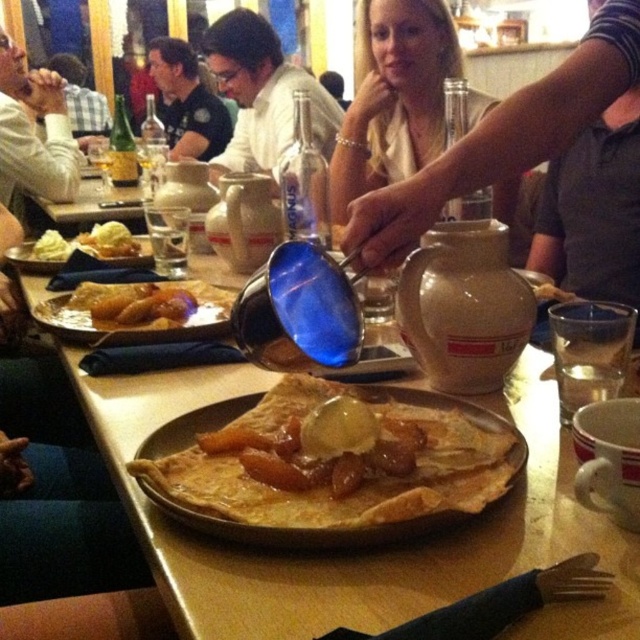
Question: Considering the relative positions of matte ceramic plate at center and white creamy ice cream at center in the image provided, where is matte ceramic plate at center located with respect to white creamy ice cream at center?

Choices:
 (A) above
 (B) below

Answer: (B)

Question: Which object is closer to the camera taking this photo?

Choices:
 (A) crispy golden-brown fried potatoes at center
 (B) matte ceramic plate at center

Answer: (B)

Question: Is matte ceramic plate at center smaller than white creamy ice cream at center?

Choices:
 (A) yes
 (B) no

Answer: (B)

Question: Which object is closer to the camera taking this photo?

Choices:
 (A) golden crispy crepe at center
 (B) crispy golden-brown fried potatoes at center
 (C) matte ceramic plate at center

Answer: (C)

Question: Is matte ceramic plate at center in front of crispy golden-brown fried potatoes at center?

Choices:
 (A) yes
 (B) no

Answer: (A)

Question: Which of the following is the closest to the observer?

Choices:
 (A) white creamy ice cream at center
 (B) golden crispy crepe at center
 (C) smooth beige teapot at center

Answer: (B)